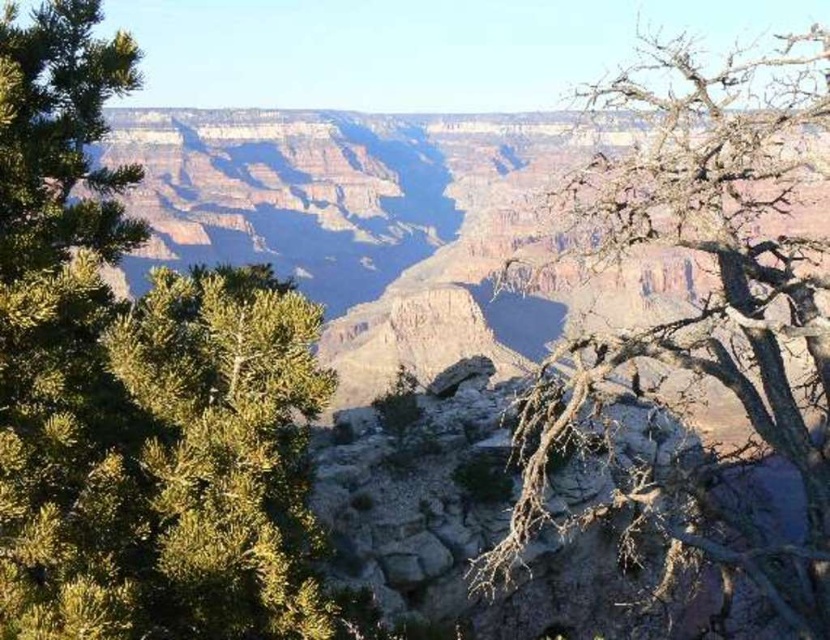
Who is more distant from viewer, (x=315, y=637) or (x=667, y=182)?

The point (x=667, y=182) is more distant.

Which is in front, point (286, 481) or point (754, 253)?

Point (286, 481)

Does point (56, 67) lie in front of point (694, 65)?

That is True.

At what (x,y) coordinates should I click in order to perform the action: click on green leafy tree at left. Please return your answer as a coordinate pair (x, y). The width and height of the screenshot is (830, 640). Looking at the image, I should click on (135, 392).